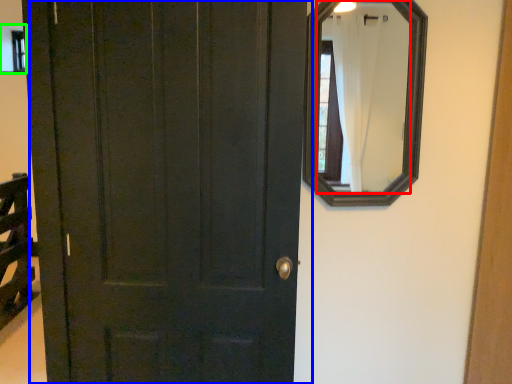
Question: Based on their relative distances, which object is farther from mirror (highlighted by a red box)? Choose from door (highlighted by a blue box) and window (highlighted by a green box).

Choices:
 (A) door
 (B) window

Answer: (A)